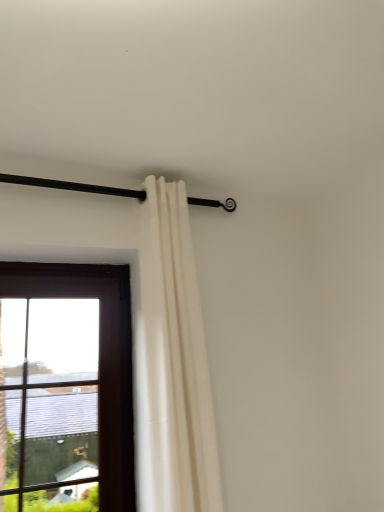
You are a GUI agent. You are given a task and a screenshot of the screen. Output one action in this format:
    pyautogui.click(x=<x>, y=<y>)
    Task: Click on the white silky curtain at upper center
    
    Given the screenshot: What is the action you would take?
    pyautogui.click(x=175, y=357)

This screenshot has height=512, width=384. Describe the element at coordinates (175, 357) in the screenshot. I see `white silky curtain at upper center` at that location.

Looking at this image, what is the approximate height of white silky curtain at upper center?

white silky curtain at upper center is 1.14 meters in height.

Where is `white silky curtain at upper center`? white silky curtain at upper center is located at coordinates click(x=175, y=357).